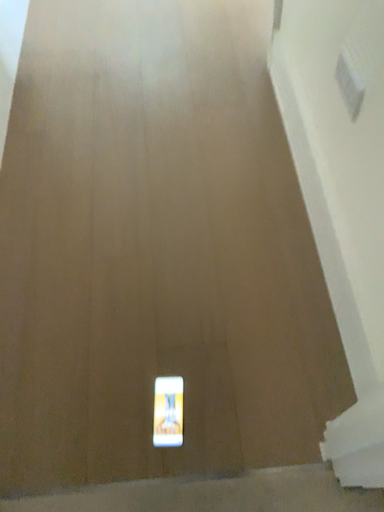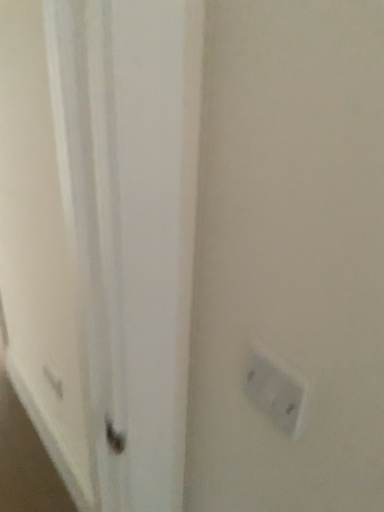
Question: How did the camera likely rotate when shooting the video?

Choices:
 (A) rotated left
 (B) rotated right

Answer: (B)